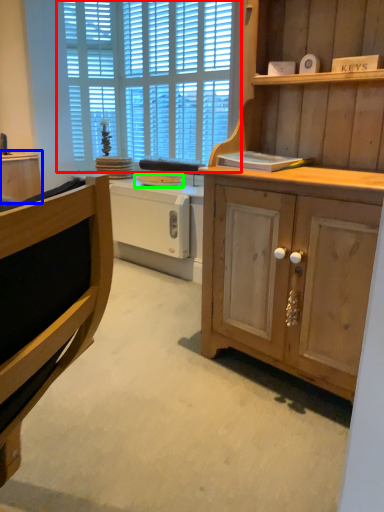
Question: Considering the real-world distances, which object is farthest from window (highlighted by a red box)? cabinetry (highlighted by a blue box) or appliance (highlighted by a green box)?

Choices:
 (A) cabinetry
 (B) appliance

Answer: (A)